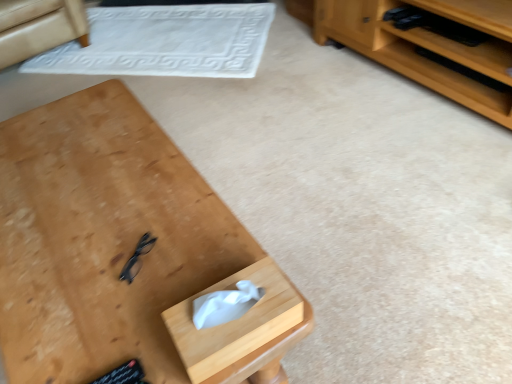
The image size is (512, 384). I want to click on free space above wooden desk at center (from a real-world perspective), so click(x=104, y=220).